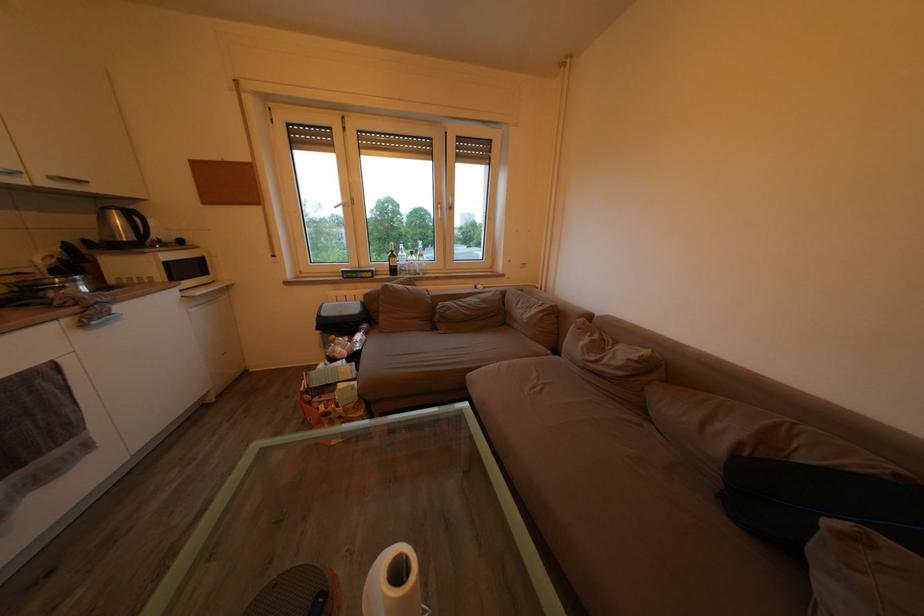
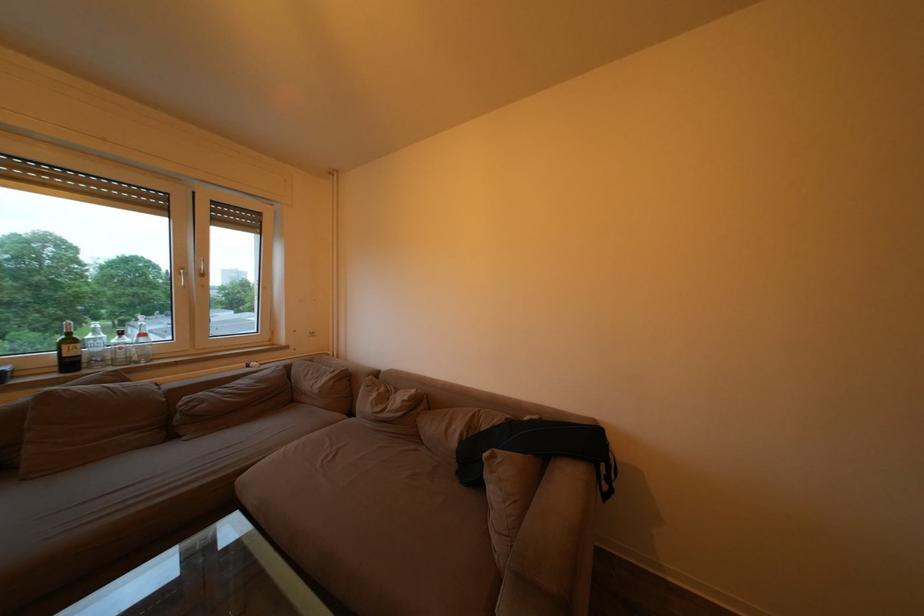
In the second image, find the point that corresponds to (x=429, y=262) in the first image.

(151, 341)